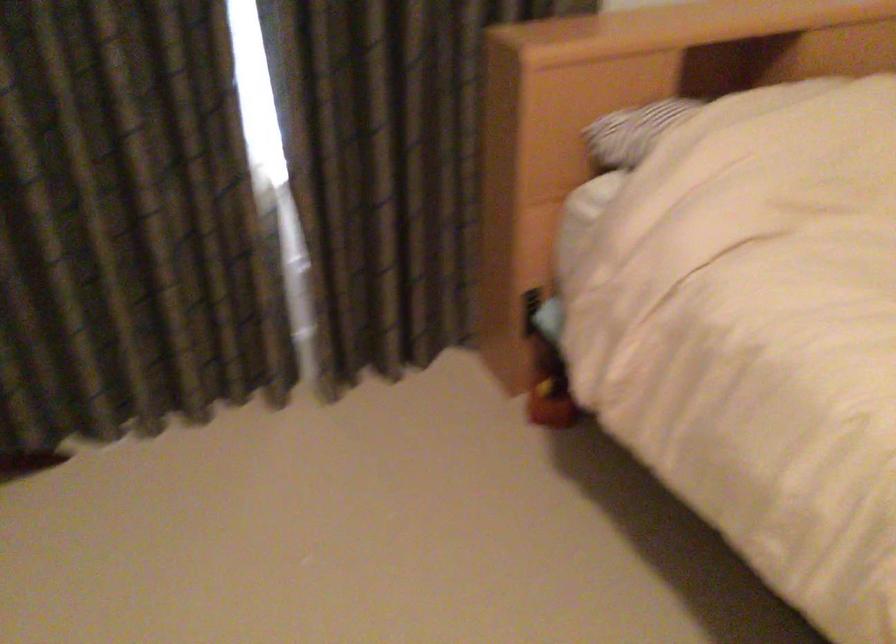
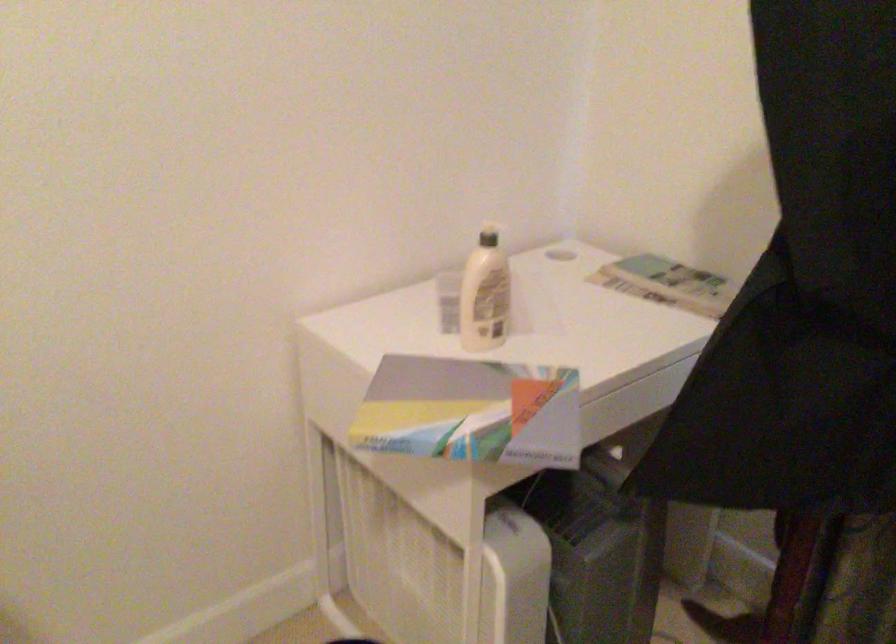
Question: The images are taken continuously from a first-person perspective. In which direction is your viewpoint rotating?

Choices:
 (A) Left
 (B) Right
 (C) Up
 (D) Down

Answer: (A)